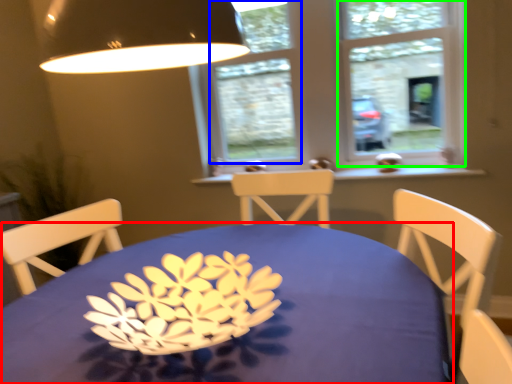
Question: Considering the real-world distances, which object is farthest from table (highlighted by a red box)? window (highlighted by a blue box) or window frame (highlighted by a green box)?

Choices:
 (A) window
 (B) window frame

Answer: (A)